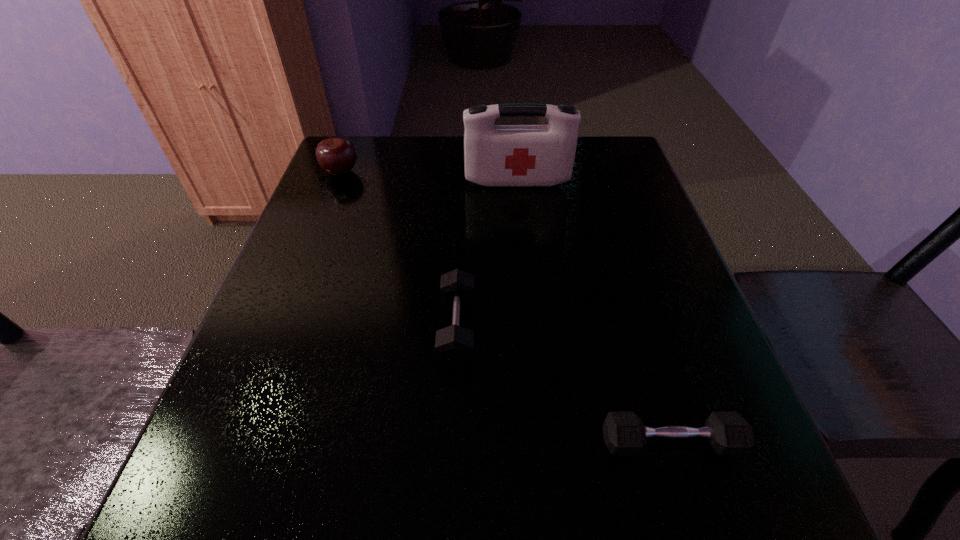
You are a GUI agent. You are given a task and a screenshot of the screen. Output one action in this format:
    pyautogui.click(x=<x>, y=<y>)
    Task: Click on the vacant space in between the taller dumbbell and the apple
    This screenshot has width=960, height=540.
    Given the screenshot: What is the action you would take?
    pyautogui.click(x=399, y=250)

At what (x,y) coordinates should I click in order to perform the action: click on object that stands as the closest to the shortest object. Please return your answer as a coordinate pair (x, y). The width and height of the screenshot is (960, 540). Looking at the image, I should click on (454, 345).

Image resolution: width=960 pixels, height=540 pixels. In order to click on object that is the third closest one to the second nearest object in this screenshot , I will do `click(337, 156)`.

This screenshot has width=960, height=540. I want to click on vacant region that satisfies the following two spatial constraints: 1. on the front side of the first-aid kit; 2. on the left side of the shortest object, so click(x=544, y=442).

Identify the location of vacant region that satisfies the following two spatial constraints: 1. on the front side of the right dumbbell; 2. on the left side of the taller dumbbell. Image resolution: width=960 pixels, height=540 pixels. click(452, 442).